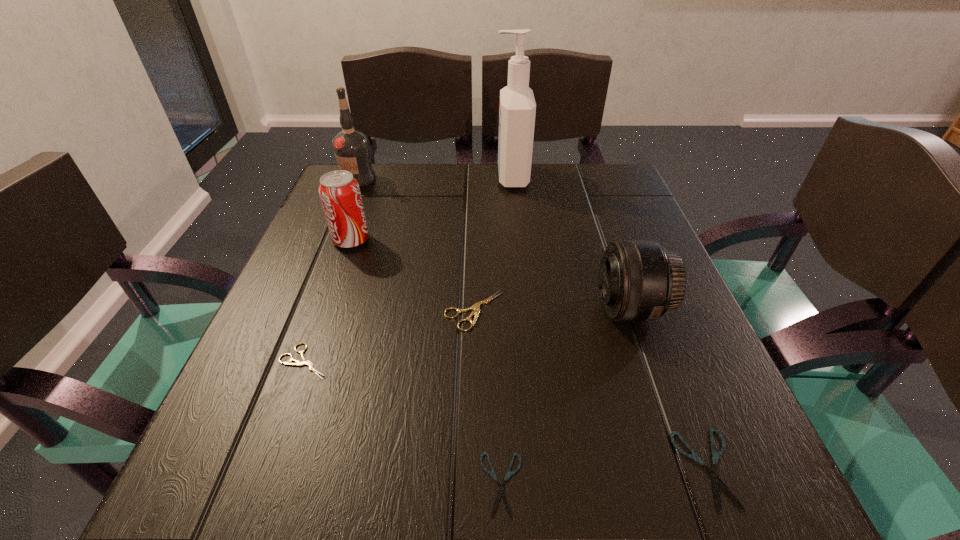
You are a GUI agent. You are given a task and a screenshot of the screen. Output one action in this format:
    pyautogui.click(x=<x>, y=<y>)
    Task: Click on the tallest object
    
    Given the screenshot: What is the action you would take?
    pyautogui.click(x=517, y=110)

At what (x,y) coordinates should I click in order to perform the action: click on the seventh shortest object. Please return your answer as a coordinate pair (x, y). Looking at the image, I should click on (351, 147).

Where is `the sixth nearest object`? Image resolution: width=960 pixels, height=540 pixels. the sixth nearest object is located at coordinates (339, 191).

Where is `soda can`? The image size is (960, 540). soda can is located at coordinates (339, 191).

The image size is (960, 540). Find the location of `telephoto lens`. telephoto lens is located at coordinates (639, 280).

Where is `the tallest shears`? This screenshot has width=960, height=540. the tallest shears is located at coordinates (475, 307).

Where is `the farther beige shears`? The height and width of the screenshot is (540, 960). the farther beige shears is located at coordinates (475, 307).

The height and width of the screenshot is (540, 960). I want to click on the nearer beige shears, so click(305, 361).

Locate an element on the screen. the second farthest shears is located at coordinates (305, 361).

Locate an element on the screen. The width and height of the screenshot is (960, 540). the right black shears is located at coordinates (716, 480).